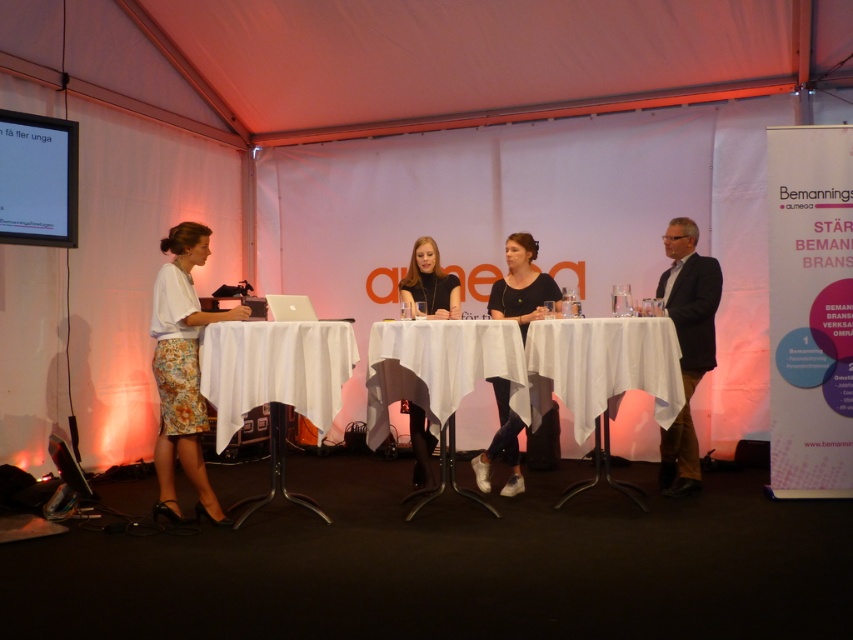
Question: Is dark blue suit at right thinner than black matte dress at center?

Choices:
 (A) no
 (B) yes

Answer: (A)

Question: Based on their relative distances, which object is nearer to the matte black shoes at center?

Choices:
 (A) white fabric table at center
 (B) dark blue suit at right
 (C) black matte dress at center

Answer: (C)

Question: Can you confirm if dark blue suit at right is positioned below matte black shoes at center?

Choices:
 (A) no
 (B) yes

Answer: (B)

Question: From the image, what is the correct spatial relationship of white cloth-covered table at center in relation to black matte dress at center?

Choices:
 (A) left
 (B) right

Answer: (A)

Question: Which point is farther to the camera?

Choices:
 (A) (691, 381)
 (B) (399, 353)

Answer: (A)

Question: Among these points, which one is nearest to the camera?

Choices:
 (A) (500, 429)
 (B) (273, 381)
 (C) (515, 348)

Answer: (B)